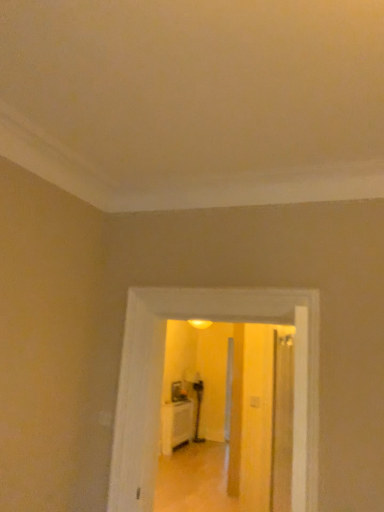
You are a GUI agent. You are given a task and a screenshot of the screen. Output one action in this format:
    pyautogui.click(x=<x>, y=<y>)
    Task: Click on the white glossy door at center
    The height and width of the screenshot is (512, 384).
    Given the screenshot: What is the action you would take?
    pyautogui.click(x=162, y=372)

What do you see at coordinates (162, 372) in the screenshot?
I see `white glossy door at center` at bounding box center [162, 372].

The width and height of the screenshot is (384, 512). I want to click on white glossy door at center, so pos(162,372).